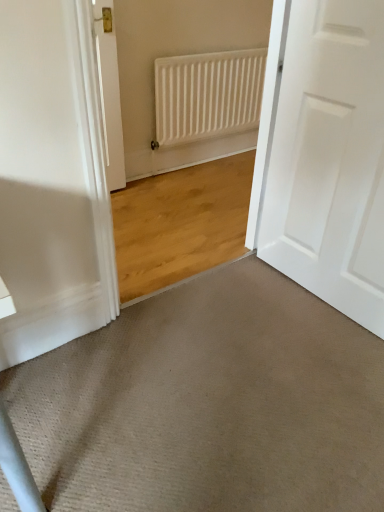
Question: Considering the positions of white matte radiator at upper center and beige carpet at lower center in the image, is white matte radiator at upper center taller or shorter than beige carpet at lower center?

Choices:
 (A) short
 (B) tall

Answer: (B)

Question: Is white matte radiator at upper center in front of or behind beige carpet at lower center in the image?

Choices:
 (A) behind
 (B) front

Answer: (A)

Question: Which object is positioned farthest from the white matte door at right?

Choices:
 (A) white matte radiator at upper center
 (B) beige carpet at lower center

Answer: (A)

Question: Estimate the real-world distances between objects in this image. Which object is closer to the white matte radiator at upper center?

Choices:
 (A) beige carpet at lower center
 (B) white matte door at right

Answer: (B)